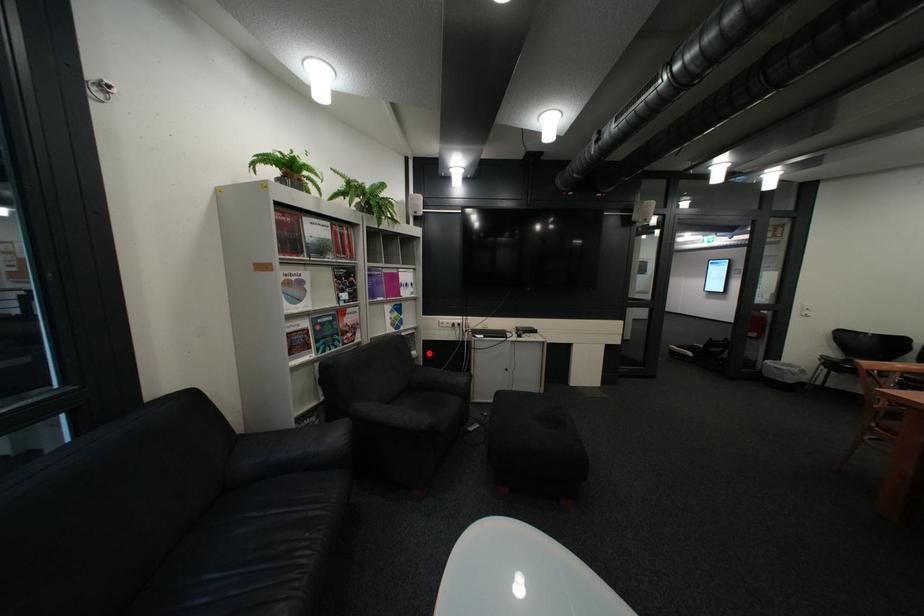
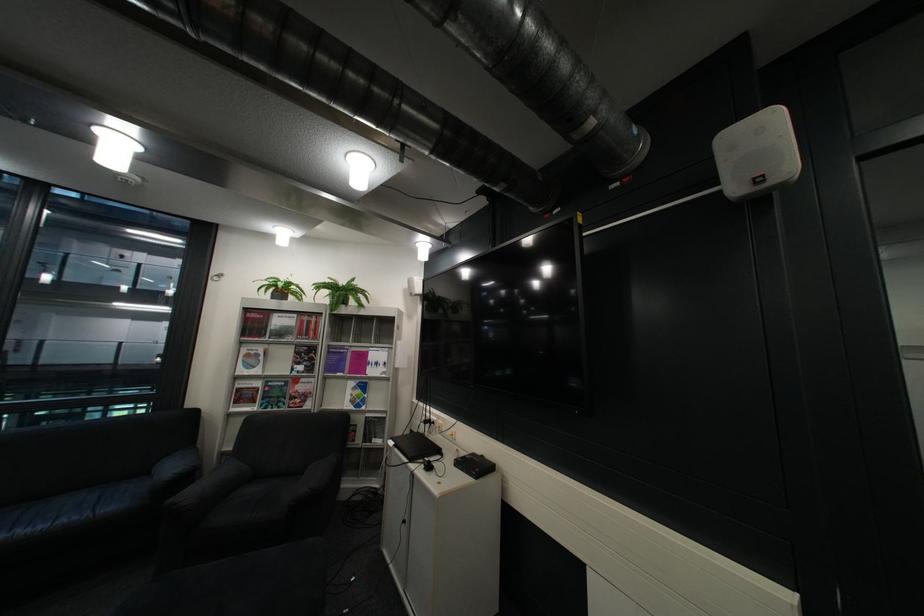
Question: I am providing you with two images of the same scene from different viewpoints. A red point is marked on the first image. At the location where the point appears in image 1, is it still visible in image 2?

Choices:
 (A) Yes
 (B) No

Answer: (A)